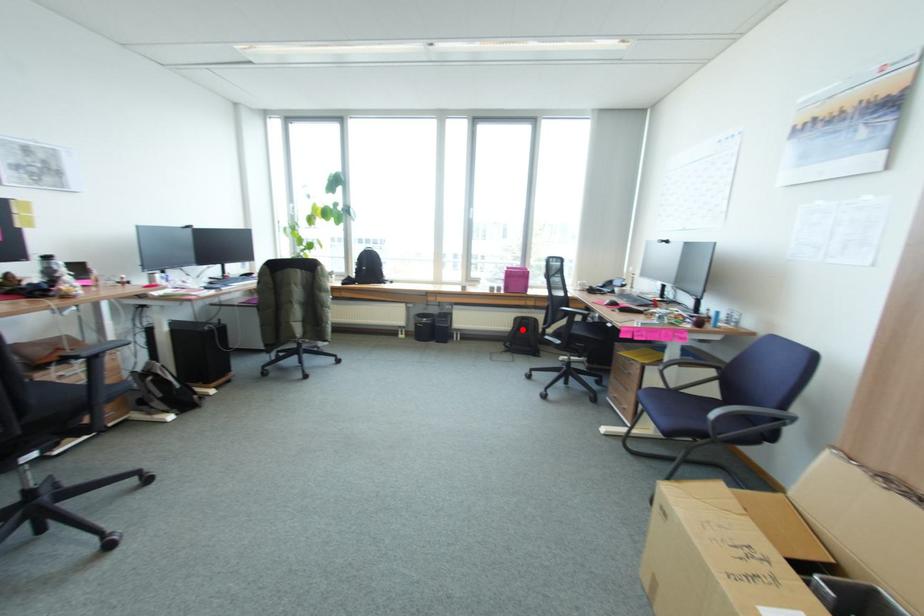
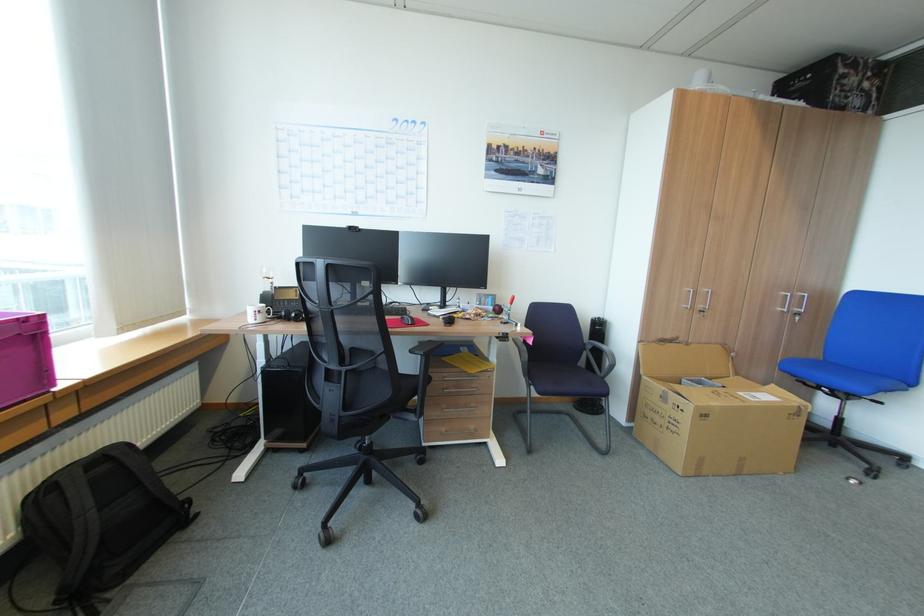
The point at the highlighted location is marked in the first image. Where is the corresponding point in the second image?

(103, 511)